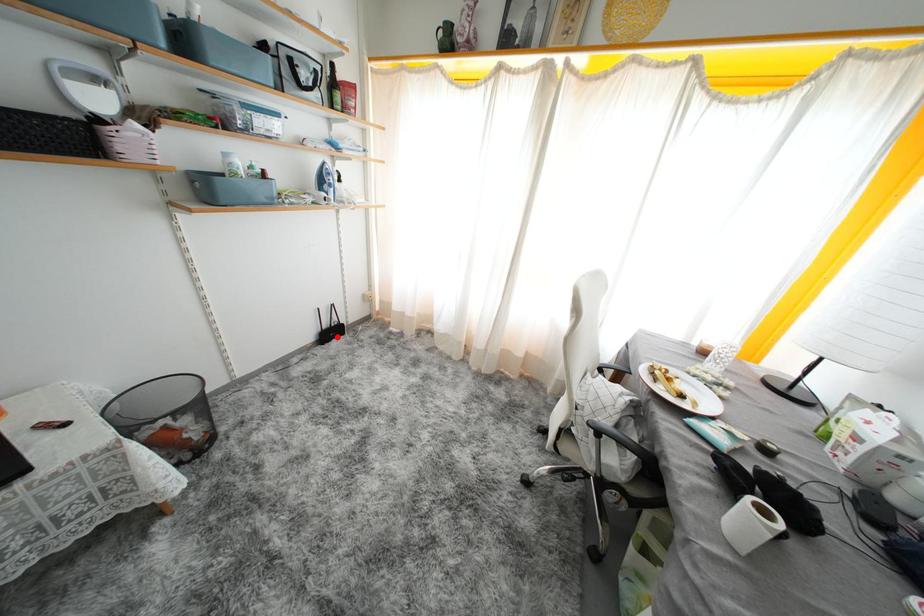
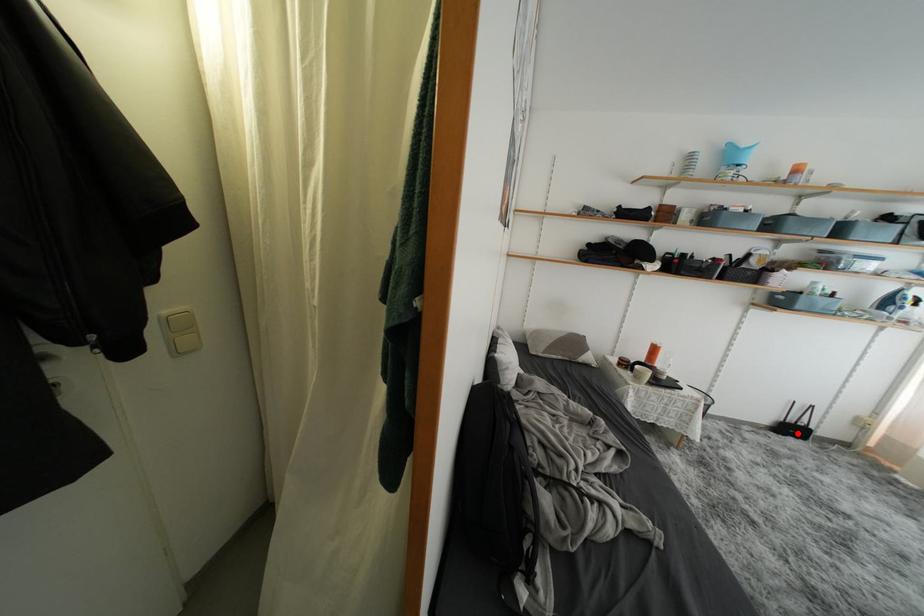
I am providing you with two images of the same scene from different viewpoints. A red point is marked on the first image and another point is marked on the second image. Is the red point in image1 aligned with the point shown in image2?

Yes